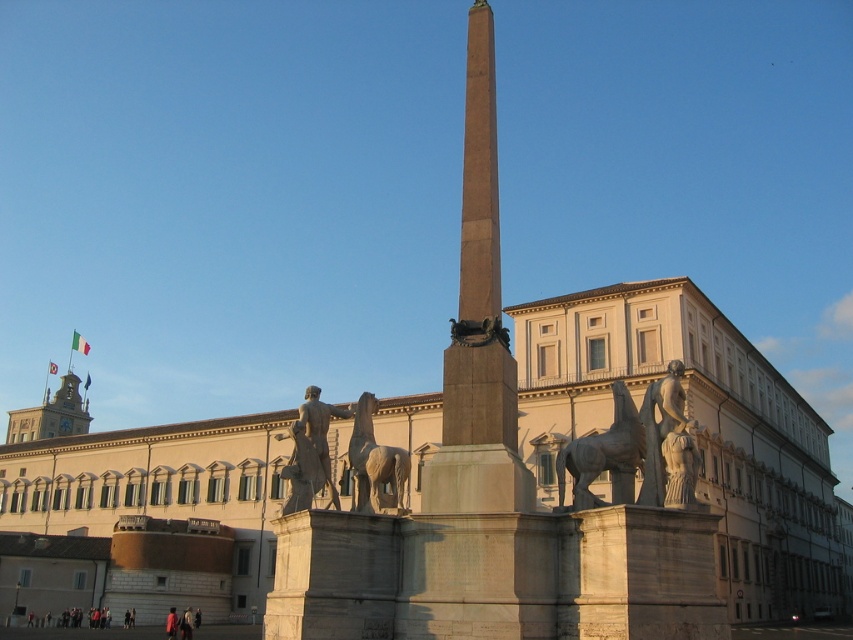
You are standing at the center of the scene and looking towards the large obelisk. There is a point marked at coordinates point [668,444]. What object is located at that point?

The point [668,444] marks the location of the polished stone statue at right.

Based on the photo, you are standing at the center of the scene and want to locate the polished stone statue at right. According to the coordinates provided, in which direction should you look to find it?

The polished stone statue at right is located at coordinates point (668, 444), which means it is to the right and slightly above the center of the scene. You should look to your right and slightly upwards to find it.